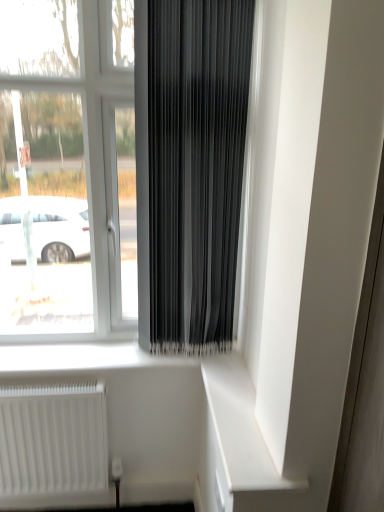
The image size is (384, 512). In order to click on blank space above white matte shelf at lower right (from a real-world perspective) in this screenshot , I will do `click(237, 397)`.